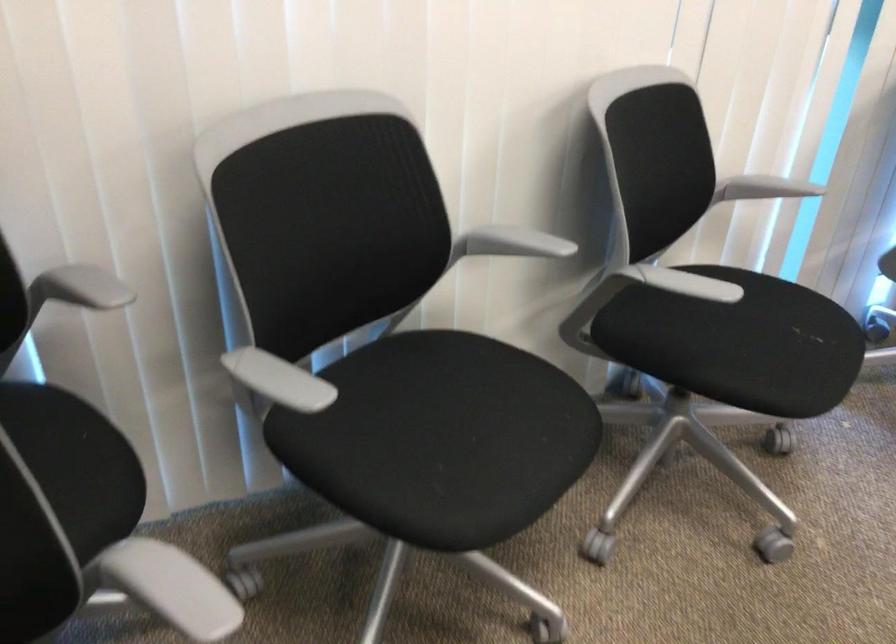
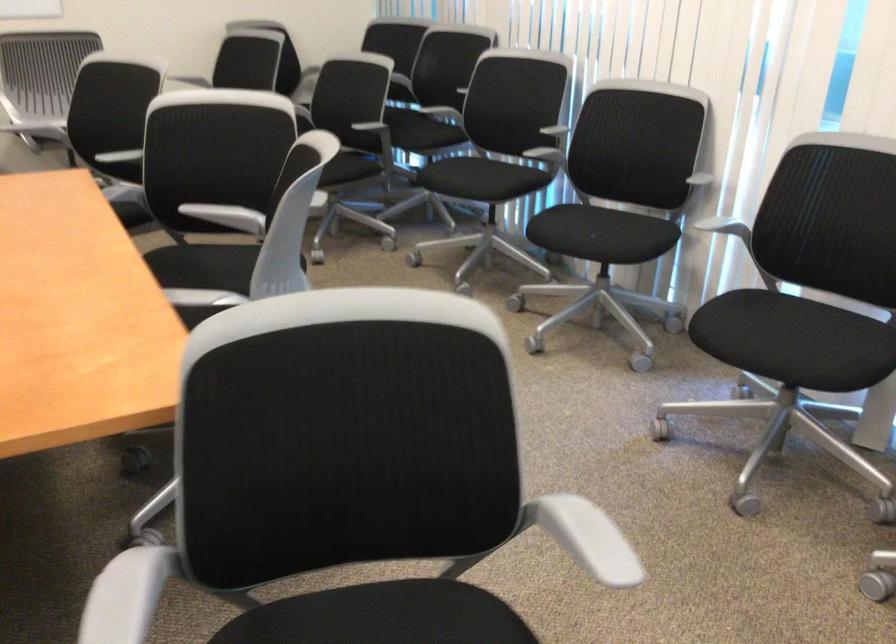
Where in the second image is the point corresponding to [707,182] from the first image?

(693, 174)